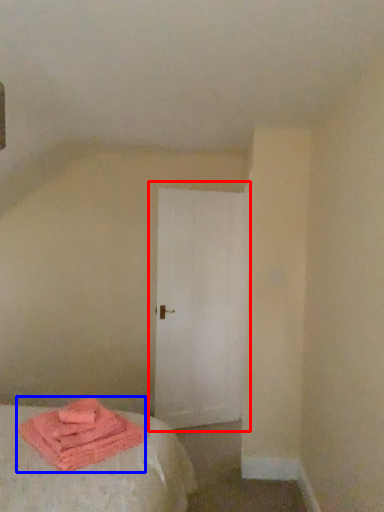
Question: Among these objects, which one is farthest to the camera, door (highlighted by a red box) or material (highlighted by a blue box)?

Choices:
 (A) door
 (B) material

Answer: (A)